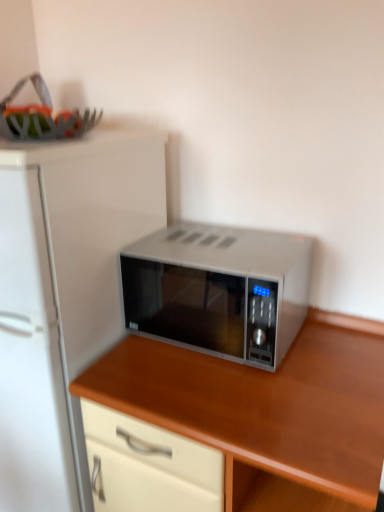
You are a GUI agent. You are given a task and a screenshot of the screen. Output one action in this format:
    pyautogui.click(x=<x>, y=<y>)
    Task: Click on the free space above satin silver microwave at center (from a real-world perspective)
    The height and width of the screenshot is (512, 384).
    Given the screenshot: What is the action you would take?
    pyautogui.click(x=220, y=243)